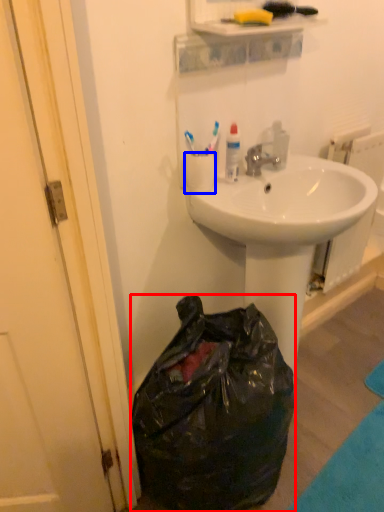
Question: Among these objects, which one is farthest to the camera, trash bin/can (highlighted by a red box) or coffee cup (highlighted by a blue box)?

Choices:
 (A) trash bin/can
 (B) coffee cup

Answer: (B)